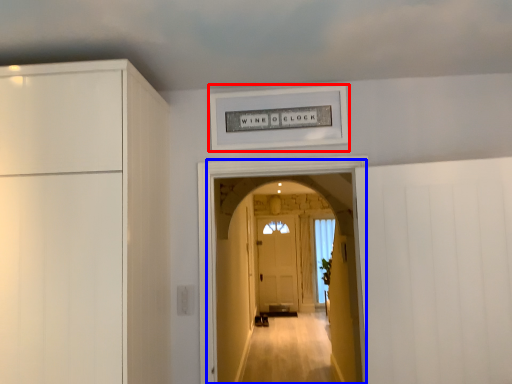
Question: Which of the following is the closest to the observer, picture frame (highlighted by a red box) or corridor (highlighted by a blue box)?

Choices:
 (A) picture frame
 (B) corridor

Answer: (B)